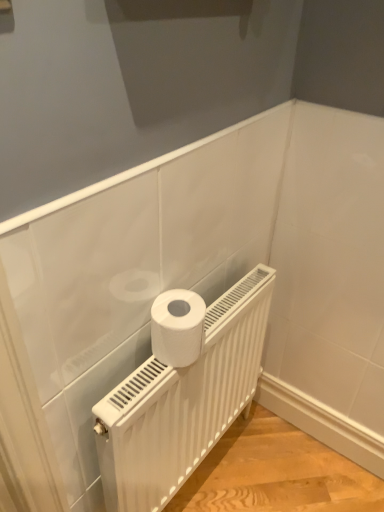
Question: From the image's perspective, is white matte toilet paper at center beneath white matte radiator at center?

Choices:
 (A) yes
 (B) no

Answer: (B)

Question: From a real-world perspective, is white matte toilet paper at center beneath white matte radiator at center?

Choices:
 (A) no
 (B) yes

Answer: (A)

Question: Does white matte toilet paper at center have a greater height compared to white matte radiator at center?

Choices:
 (A) no
 (B) yes

Answer: (A)

Question: Does white matte toilet paper at center have a smaller size compared to white matte radiator at center?

Choices:
 (A) yes
 (B) no

Answer: (A)

Question: Can you confirm if white matte toilet paper at center is positioned to the left of white matte radiator at center?

Choices:
 (A) no
 (B) yes

Answer: (B)

Question: Can you confirm if white matte toilet paper at center is wider than white matte radiator at center?

Choices:
 (A) no
 (B) yes

Answer: (B)

Question: Is white matte radiator at center closer to the viewer compared to white matte toilet paper at center?

Choices:
 (A) yes
 (B) no

Answer: (A)

Question: Is white matte radiator at center thinner than white matte toilet paper at center?

Choices:
 (A) yes
 (B) no

Answer: (A)

Question: Is white matte radiator at center shorter than white matte toilet paper at center?

Choices:
 (A) yes
 (B) no

Answer: (B)

Question: From a real-world perspective, is white matte radiator at center on white matte toilet paper at center?

Choices:
 (A) no
 (B) yes

Answer: (A)

Question: Is white matte toilet paper at center at the back of white matte radiator at center?

Choices:
 (A) no
 (B) yes

Answer: (A)

Question: Can you confirm if white matte radiator at center is taller than white matte toilet paper at center?

Choices:
 (A) yes
 (B) no

Answer: (A)

Question: From a real-world perspective, is white matte toilet paper at center above or below white matte radiator at center?

Choices:
 (A) below
 (B) above

Answer: (B)